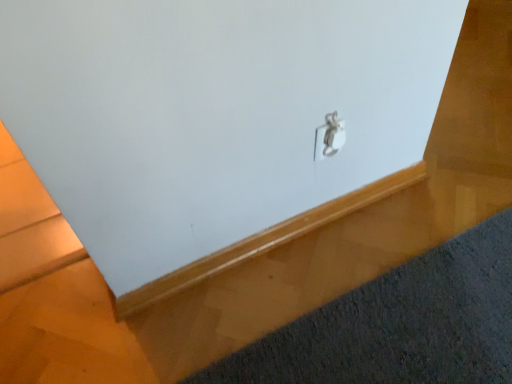
Describe the element at coordinates (399, 324) in the screenshot. The height and width of the screenshot is (384, 512). I see `dark gray carpet at lower right` at that location.

Locate an element on the screen. Image resolution: width=512 pixels, height=384 pixels. dark gray carpet at lower right is located at coordinates (399, 324).

Consider the image. Measure the distance between point (x=334, y=131) and camera.

The distance of point (x=334, y=131) from camera is 3.31 feet.

Locate an element on the screen. The width and height of the screenshot is (512, 384). silver metallic lock at center is located at coordinates (329, 137).

Describe the element at coordinates (329, 137) in the screenshot. I see `silver metallic lock at center` at that location.

At what (x,y) coordinates should I click in order to perform the action: click on dark gray carpet at lower right. Please return your answer as a coordinate pair (x, y). Looking at the image, I should click on (399, 324).

Considering the positions of objects silver metallic lock at center and dark gray carpet at lower right in the image provided, who is more to the left, silver metallic lock at center or dark gray carpet at lower right?

silver metallic lock at center.

Relative to dark gray carpet at lower right, is silver metallic lock at center in front or behind?

silver metallic lock at center is behind dark gray carpet at lower right.

Considering the positions of points (322, 131) and (288, 363), is point (322, 131) farther from camera compared to point (288, 363)?

Yes, it is behind point (288, 363).

From the image's perspective, which one is positioned higher, silver metallic lock at center or dark gray carpet at lower right?

silver metallic lock at center is shown above in the image.

From the picture: From a real-world perspective, is silver metallic lock at center above or below dark gray carpet at lower right?

Clearly, from a real-world perspective, silver metallic lock at center is above dark gray carpet at lower right.

Can you confirm if silver metallic lock at center is thinner than dark gray carpet at lower right?

Correct, the width of silver metallic lock at center is less than that of dark gray carpet at lower right.

From the picture: Is silver metallic lock at center shorter than dark gray carpet at lower right?

No, silver metallic lock at center is not shorter than dark gray carpet at lower right.

From the picture: Which of these two, silver metallic lock at center or dark gray carpet at lower right, is bigger?

dark gray carpet at lower right is bigger.

In the scene shown: Do you think silver metallic lock at center is within dark gray carpet at lower right, or outside of it?

silver metallic lock at center cannot be found inside dark gray carpet at lower right.

Can you see silver metallic lock at center touching dark gray carpet at lower right?

No, silver metallic lock at center is not making contact with dark gray carpet at lower right.

Is silver metallic lock at center aimed at dark gray carpet at lower right?

No, silver metallic lock at center is not aimed at dark gray carpet at lower right.

I want to click on lock that appears above the dark gray carpet at lower right (from a real-world perspective), so click(329, 137).

Based on the photo, in the image, is dark gray carpet at lower right on the left side or the right side of silver metallic lock at center?

Based on their positions, dark gray carpet at lower right is located to the right of silver metallic lock at center.

Relative to silver metallic lock at center, is dark gray carpet at lower right in front or behind?

In the image, dark gray carpet at lower right appears in front of silver metallic lock at center.

Between point (447, 298) and point (331, 116), which one is positioned in front?

Point (331, 116)

From the image's perspective, is dark gray carpet at lower right located above or below silver metallic lock at center?

dark gray carpet at lower right is below silver metallic lock at center.

From a real-world perspective, is dark gray carpet at lower right physically located above or below silver metallic lock at center?

From a real-world perspective, dark gray carpet at lower right is physically below silver metallic lock at center.

Which object is thinner, dark gray carpet at lower right or silver metallic lock at center?

With smaller width is silver metallic lock at center.

Which of these two, dark gray carpet at lower right or silver metallic lock at center, stands taller?

Answer: Standing taller between the two is silver metallic lock at center.

Which of these two, dark gray carpet at lower right or silver metallic lock at center, is smaller?

silver metallic lock at center.

Is dark gray carpet at lower right completely or partially outside of silver metallic lock at center?

Absolutely, dark gray carpet at lower right is external to silver metallic lock at center.

Is dark gray carpet at lower right far from silver metallic lock at center?

No, there isn't a large distance between dark gray carpet at lower right and silver metallic lock at center.

Is dark gray carpet at lower right aimed at silver metallic lock at center?

No.

How many degrees apart are the facing directions of dark gray carpet at lower right and silver metallic lock at center?

The angle between the facing direction of dark gray carpet at lower right and the facing direction of silver metallic lock at center is 180 degrees.

Locate an element on the screen. This screenshot has width=512, height=384. mat below the silver metallic lock at center (from a real-world perspective) is located at coordinates (399, 324).

Image resolution: width=512 pixels, height=384 pixels. Find the location of `mat located on the right of silver metallic lock at center`. mat located on the right of silver metallic lock at center is located at coordinates (399, 324).

Find the location of a particular element. This screenshot has height=384, width=512. mat that is under the silver metallic lock at center (from a real-world perspective) is located at coordinates (399, 324).